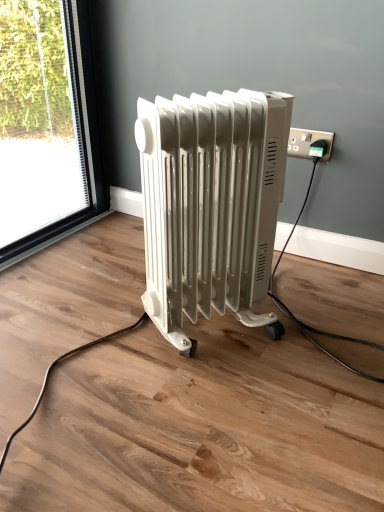
This screenshot has width=384, height=512. What are the coordinates of `vacant area to the right of white glossy radiator at center` in the screenshot? It's located at (319, 338).